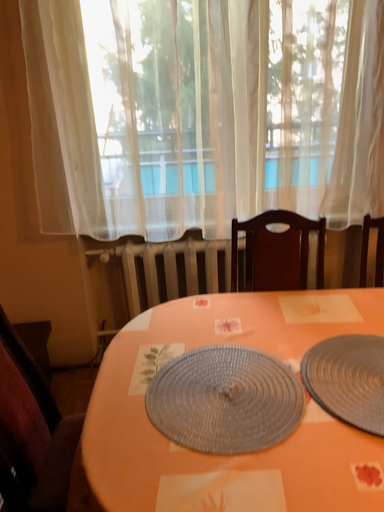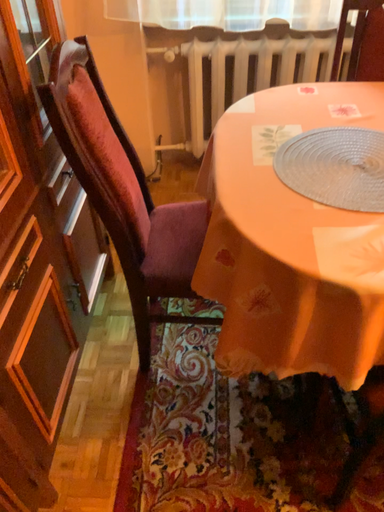
Question: Which way did the camera rotate in the video?

Choices:
 (A) rotated upward
 (B) rotated downward

Answer: (B)